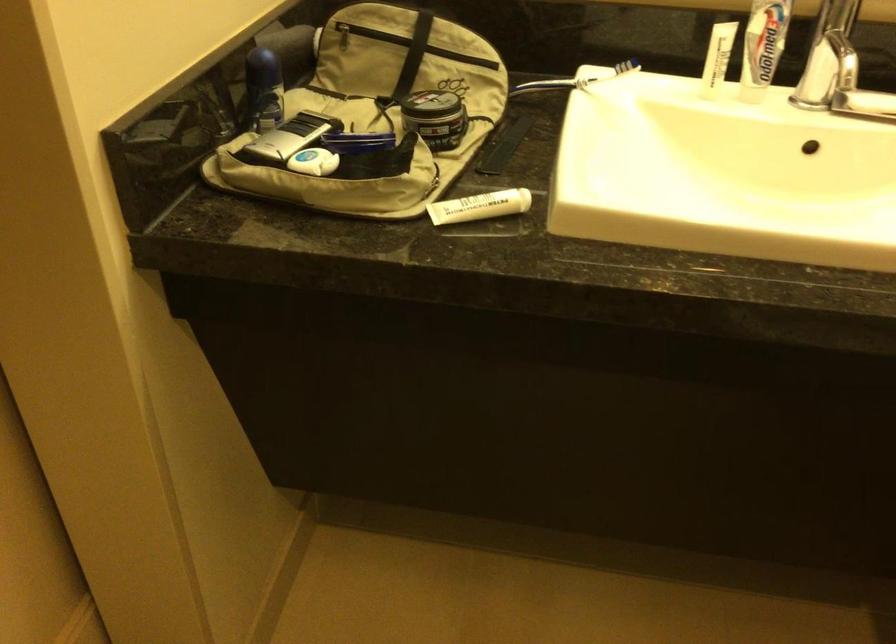
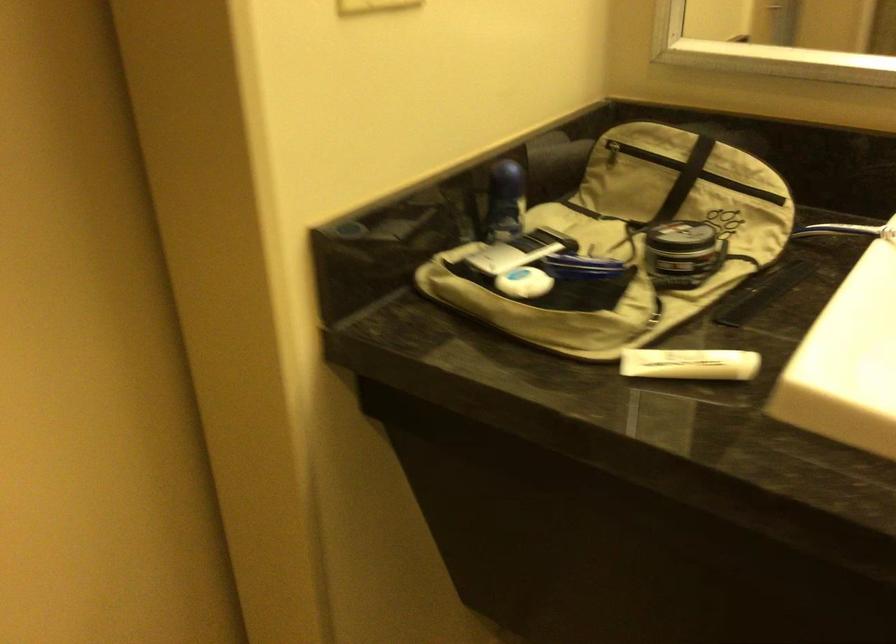
Question: The first image is from the beginning of the video and the second image is from the end. How did the camera likely rotate when shooting the video?

Choices:
 (A) Left
 (B) Right
 (C) Up
 (D) Down

Answer: (A)